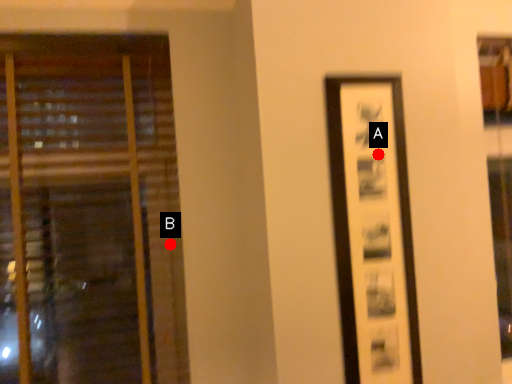
Question: Two points are circled on the image, labeled by A and B beside each circle. Which point is farther from the camera taking this photo?

Choices:
 (A) A is further
 (B) B is further

Answer: (B)